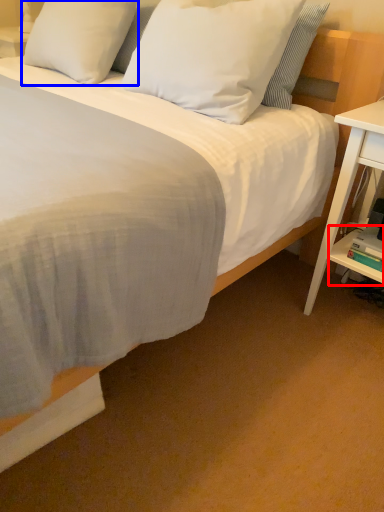
Question: Which of the following is the closest to the observer, shelf (highlighted by a red box) or pillow (highlighted by a blue box)?

Choices:
 (A) shelf
 (B) pillow

Answer: (A)